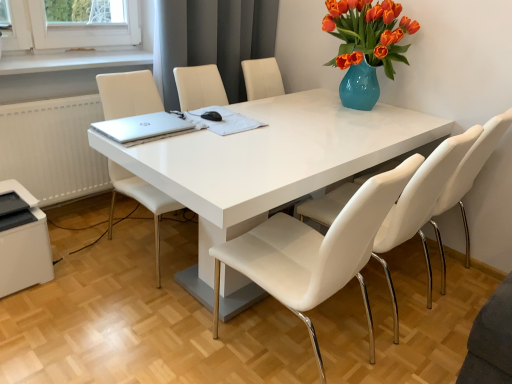
Locate an element on the screen. empty space that is to the right of white plastic printer at lower left is located at coordinates point(77,276).